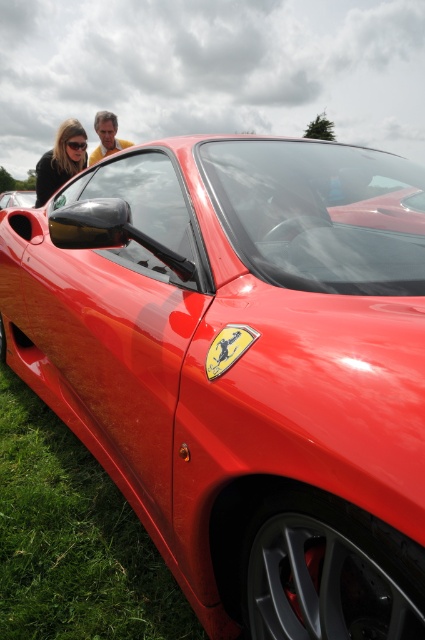
Question: Can you confirm if matte black sunglasses at upper left is thinner than matte black hair at upper left?

Choices:
 (A) no
 (B) yes

Answer: (A)

Question: Which point is farther to the camera?

Choices:
 (A) [x=113, y=132]
 (B) [x=0, y=582]

Answer: (A)

Question: Which point is closer to the camera taking this photo?

Choices:
 (A) (116, 148)
 (B) (51, 186)

Answer: (B)

Question: Can you confirm if matte black sunglasses at upper left is bigger than matte black hair at upper left?

Choices:
 (A) no
 (B) yes

Answer: (B)

Question: Is green grass at lower left above matte black sunglasses at upper left?

Choices:
 (A) yes
 (B) no

Answer: (B)

Question: Which object is the closest to the green grass at lower left?

Choices:
 (A) matte black sunglasses at upper left
 (B) matte black hair at upper left

Answer: (A)